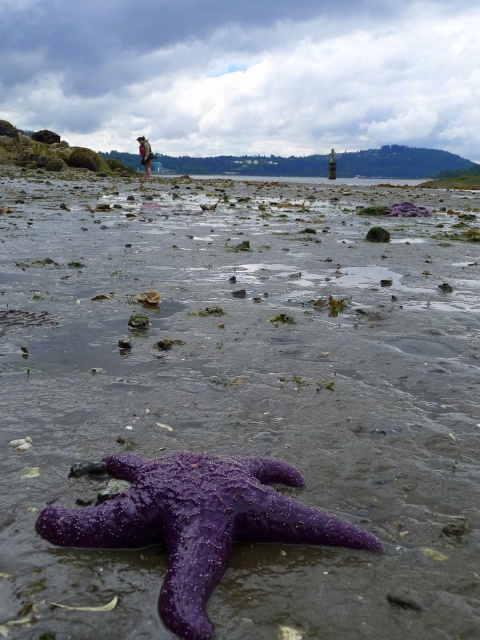
Question: In this image, where is purple wet mud at center located relative to purple rough starfish at lower center?

Choices:
 (A) below
 (B) above

Answer: (B)

Question: Among these points, which one is nearest to the camera?

Choices:
 (A) (286, 566)
 (B) (175, 609)

Answer: (B)

Question: Which point is closer to the camera?

Choices:
 (A) purple rough starfish at lower center
 (B) dark brown leather jacket at upper left
 (C) purple wet mud at center

Answer: (A)

Question: Among these objects, which one is nearest to the camera?

Choices:
 (A) purple wet mud at center
 (B) dark brown leather jacket at upper left

Answer: (A)

Question: Does purple rough starfish at lower center appear over dark brown leather jacket at upper left?

Choices:
 (A) yes
 (B) no

Answer: (B)

Question: Is purple wet mud at center bigger than purple rough starfish at lower center?

Choices:
 (A) yes
 (B) no

Answer: (A)